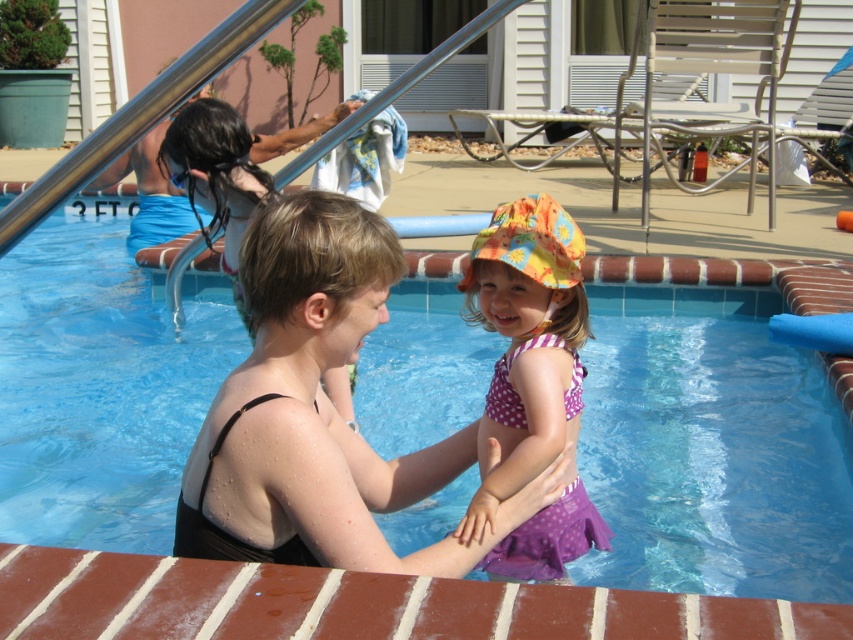
Question: Does purple polka dot swimsuit at center lie in front of blue plastic goggles at upper left?

Choices:
 (A) yes
 (B) no

Answer: (A)

Question: Which of the following is the farthest from the observer?

Choices:
 (A) (173, 186)
 (B) (543, 252)
 (C) (38, 499)

Answer: (A)

Question: Can you confirm if blue tile swimming pool at center is bigger than blue plastic goggles at upper left?

Choices:
 (A) no
 (B) yes

Answer: (B)

Question: Is purple polka dot swimsuit at center behind blue plastic goggles at upper left?

Choices:
 (A) yes
 (B) no

Answer: (B)

Question: Which is nearer to the purple polka dot swimsuit at center?

Choices:
 (A) blue tile swimming pool at center
 (B) blue plastic goggles at upper left

Answer: (A)

Question: Which point is farther from the camera taking this photo?

Choices:
 (A) (519, 312)
 (B) (33, 369)

Answer: (B)